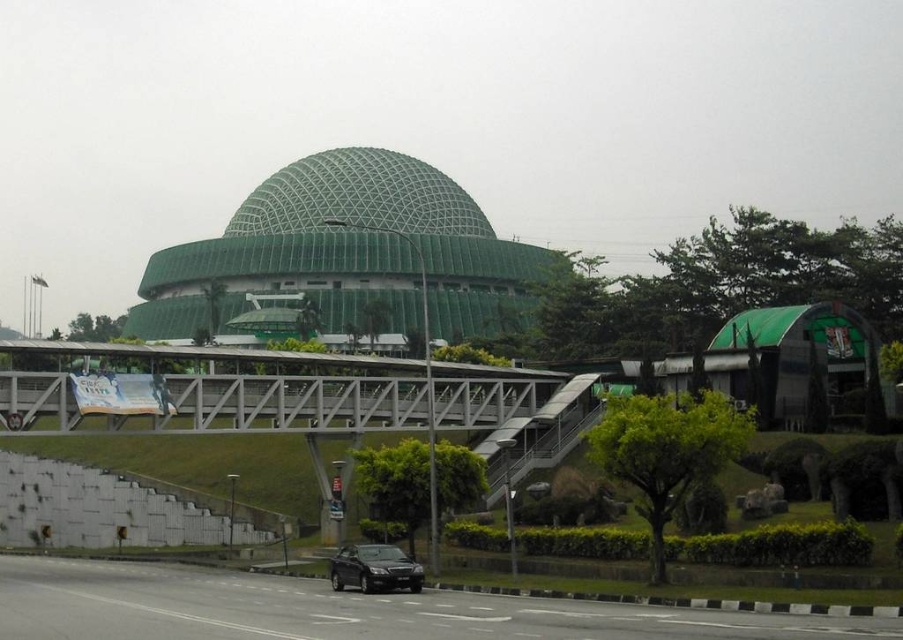
Can you confirm if green mesh dome at center is smaller than matte black car at lower center?

No.

Does green mesh dome at center come in front of matte black car at lower center?

No, green mesh dome at center is further to the viewer.

Between point (352, 176) and point (392, 579), which one is positioned in front?

Point (392, 579)

Locate an element on the screen. This screenshot has height=640, width=903. green mesh dome at center is located at coordinates (359, 196).

Can you confirm if black asphalt highway at lower center is shorter than green mesh dome at center?

Yes, black asphalt highway at lower center is shorter than green mesh dome at center.

Who is taller, black asphalt highway at lower center or green mesh dome at center?

green mesh dome at center

Is point (166, 628) closer to viewer compared to point (252, 227)?

Yes.

Locate an element on the screen. black asphalt highway at lower center is located at coordinates (343, 611).

Between white concrete pedestrian bridge at center and green mesh dome at center, which one appears on the left side from the viewer's perspective?

From the viewer's perspective, green mesh dome at center appears more on the left side.

Measure the distance between white concrete pedestrian bridge at center and camera.

white concrete pedestrian bridge at center and camera are 53.88 meters apart.

Is point (249, 378) in front of point (489, 232)?

That is True.

Locate an element on the screen. The image size is (903, 640). white concrete pedestrian bridge at center is located at coordinates (280, 394).